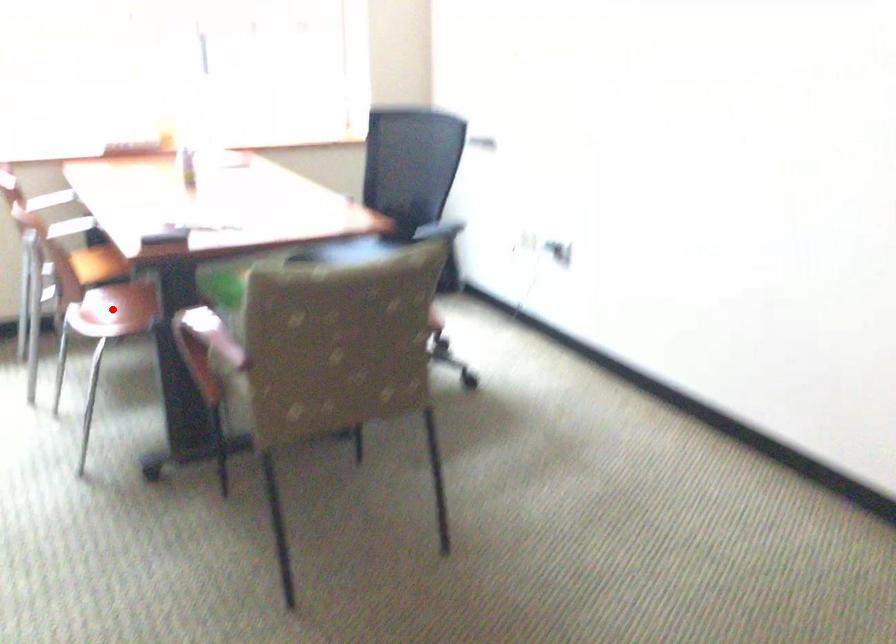
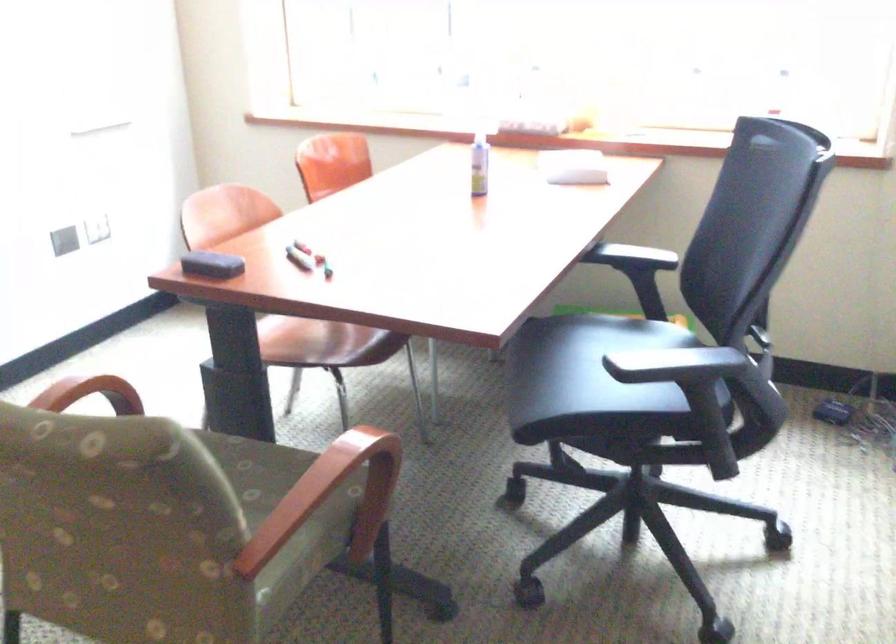
Question: I am providing you with two images of the same scene from different viewpoints. Given a red point in image1, look at the same physical point in image2. Is it:

Choices:
 (A) Closer to the viewpoint
 (B) Farther from the viewpoint

Answer: (A)